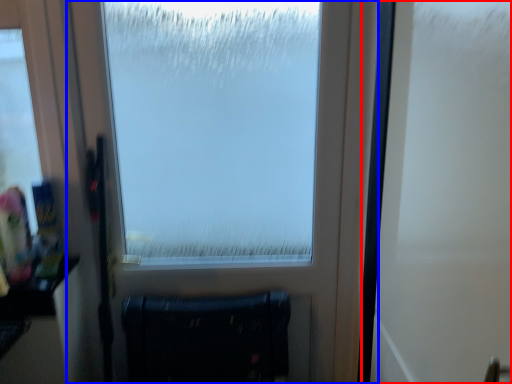
Question: Among these objects, which one is nearest to the camera, screen door (highlighted by a red box) or window (highlighted by a blue box)?

Choices:
 (A) screen door
 (B) window

Answer: (A)